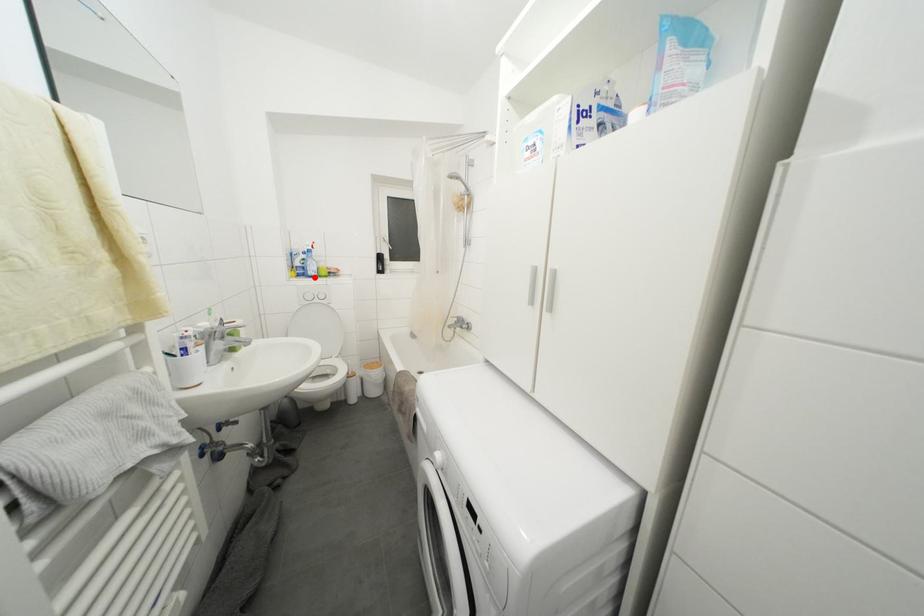
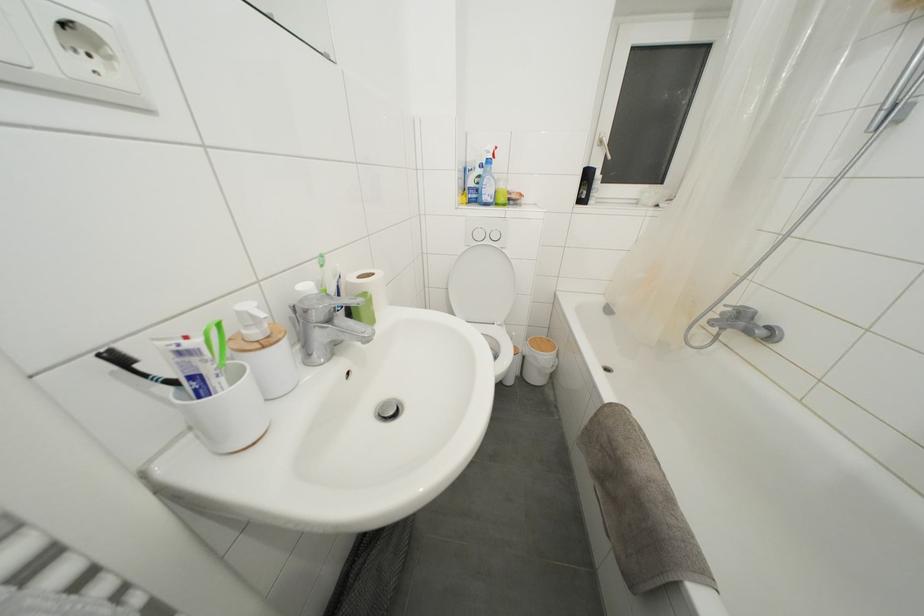
Question: A red point is marked in image1. In image2, is the corresponding 3D point closer to the camera or farther? Reply with the corresponding letter.

Choices:
 (A) The corresponding 3D point is closer.
 (B) The corresponding 3D point is farther.

Answer: (A)